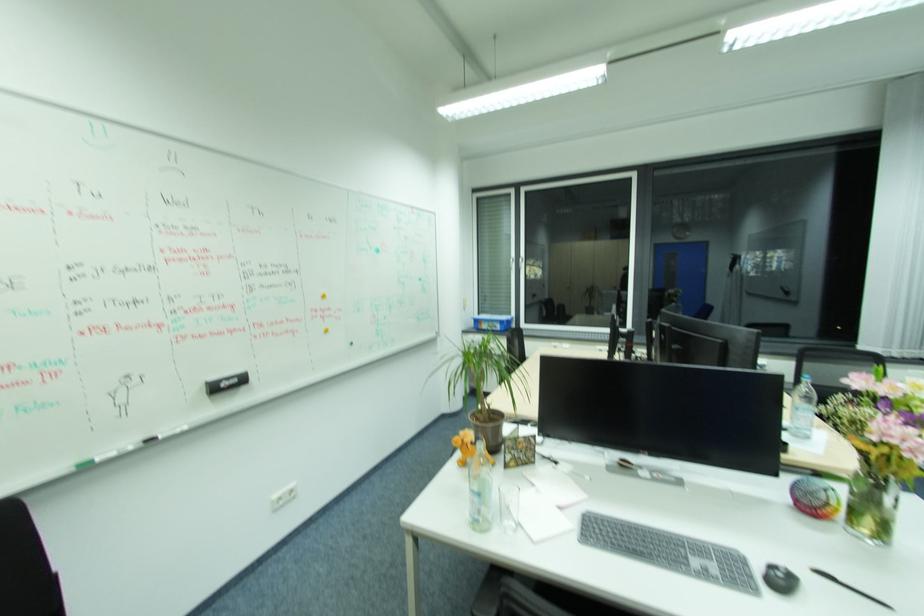
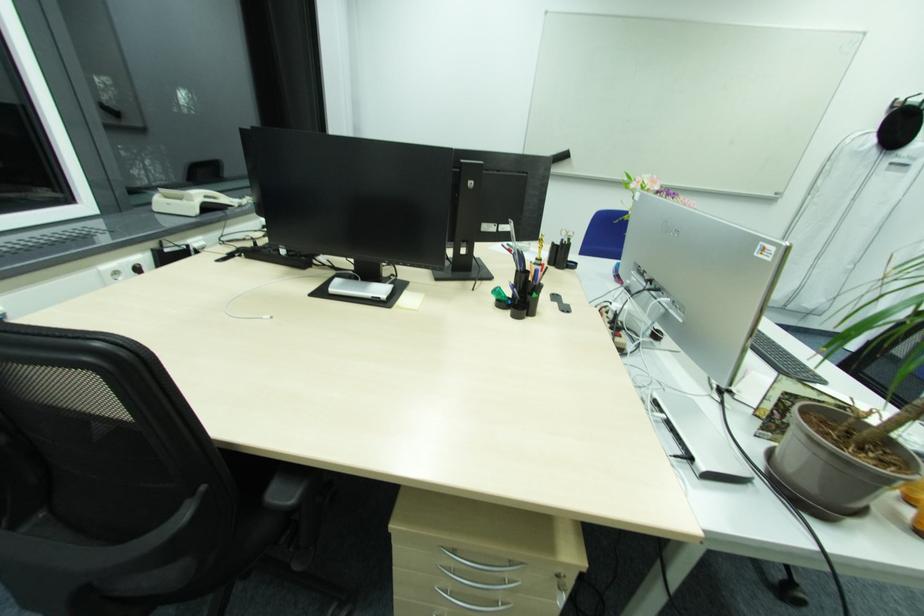
Question: I am providing you with two images of the same scene from different viewpoints. After the viewpoint changes to image2, which objects are now occluded?

Choices:
 (A) cabinet lock
 (B) pair of scissors
 (C) blue pen
 (D) none of these

Answer: (D)